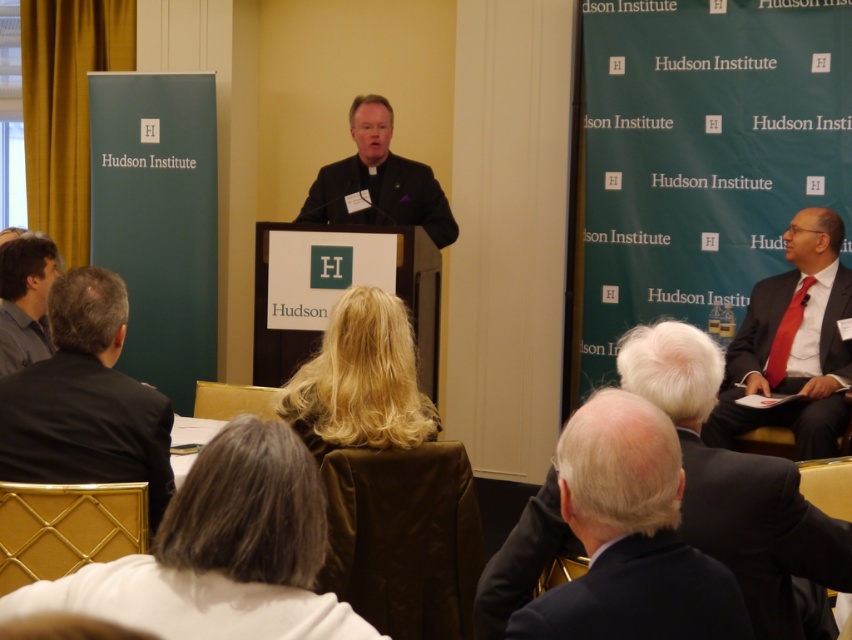
You are a photographer standing at the back of the room. You want to take a photo of the dark gray suit at lower right and ensure that the gold curtains on the left side are also visible in the frame. Can you fit both in the shot without moving your position?

The dark gray suit at lower right and the gold curtains on the left side are 1.20 meters apart. Since the photographer is at the back, they can likely capture both in the frame as the distance between them is manageable for a wide enough lens or camera angle.

You are a photographer positioned at the camera. You need to capture a photo of the matte black suit at right. Considering the distance between you and the subject, will you need to use a telephoto lens to ensure the subject fills the frame adequately?

The distance between the matte black suit at right and the camera is 3.64 meters. A telephoto lens is typically used for distant subjects to magnify the image. Whether it is needed depends on the desired framing and the focal length of the lens available. However, since the subject is over 3 meters away, using a telephoto lens would help in capturing a clear and focused image of the matte black suit at right without cropping too much.